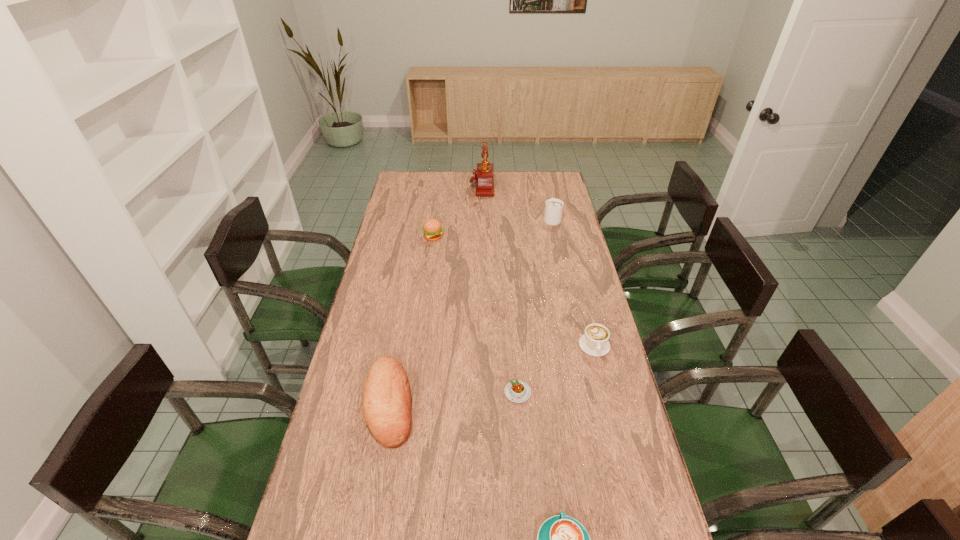
Image resolution: width=960 pixels, height=540 pixels. I want to click on the farthest object, so click(484, 178).

Where is `the tallest object`? the tallest object is located at coordinates (484, 178).

Locate an element on the screen. The image size is (960, 540). the tallest cappuccino is located at coordinates (554, 207).

Image resolution: width=960 pixels, height=540 pixels. Find the location of `the second farthest object`. the second farthest object is located at coordinates (554, 207).

The width and height of the screenshot is (960, 540). In order to click on hamburger in this screenshot , I will do `click(432, 229)`.

Locate an element on the screen. bread is located at coordinates (387, 404).

Locate an element on the screen. The height and width of the screenshot is (540, 960). the fourth nearest object is located at coordinates (594, 342).

Identify the location of pudding. (517, 391).

Where is `vacant space located on the dial of the tallest object`? The image size is (960, 540). vacant space located on the dial of the tallest object is located at coordinates (453, 186).

In order to click on free space located on the dial of the tallest object in this screenshot , I will do `click(404, 186)`.